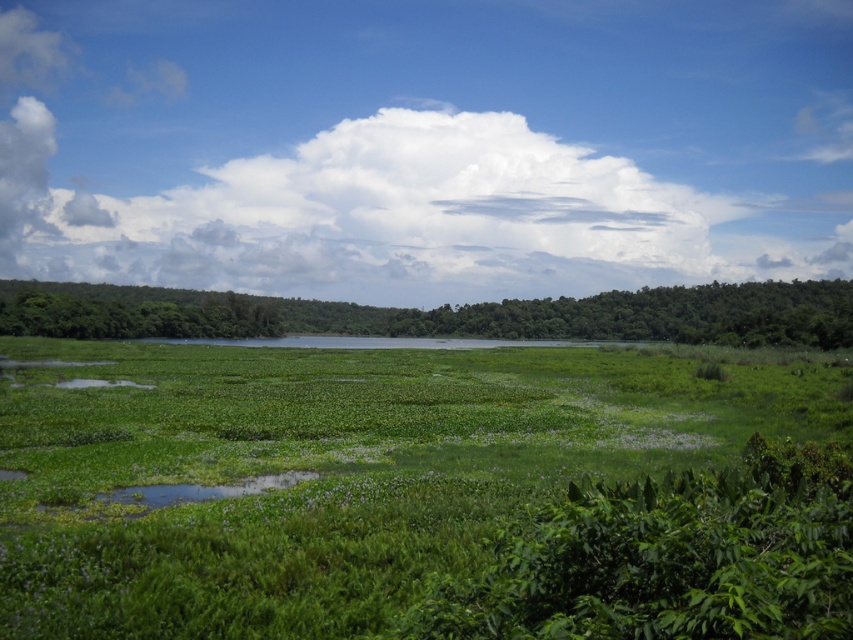
Is green leafy grass at center above green leafy tree at center?

No, green leafy grass at center is not above green leafy tree at center.

Which is below, green leafy grass at center or green leafy tree at center?

green leafy grass at center is lower down.

Locate an element on the screen. green leafy grass at center is located at coordinates (416, 493).

What are the coordinates of `green leafy grass at center` in the screenshot? It's located at (416, 493).